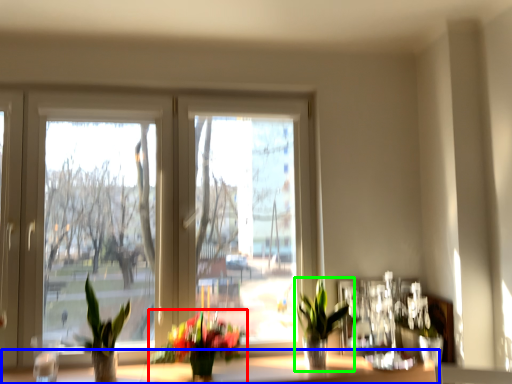
Question: Which object is positioned closest to houseplant (highlighted by a red box)? Select from window sill (highlighted by a blue box) and houseplant (highlighted by a green box).

Choices:
 (A) window sill
 (B) houseplant

Answer: (A)